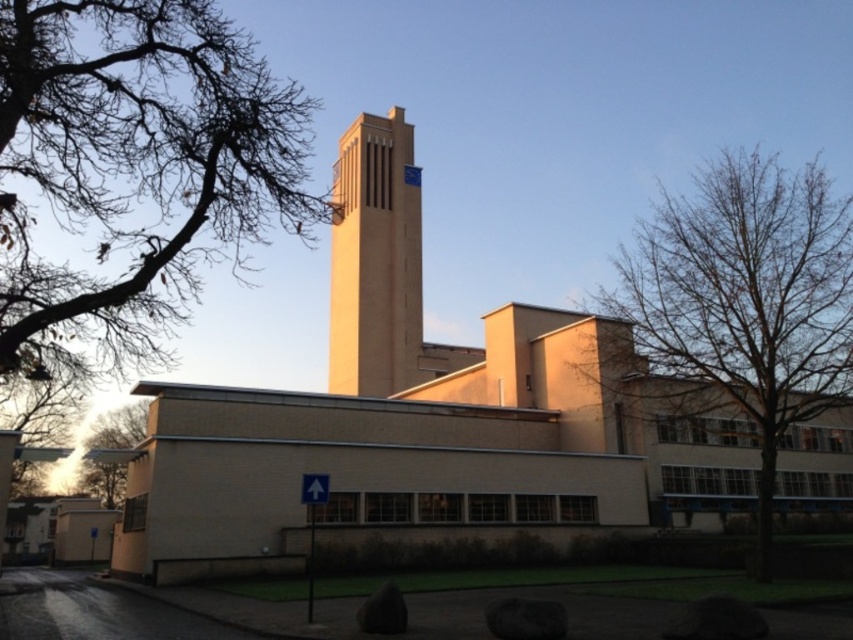
You are standing in front of the modernist building and want to take a photo of the beige brick tower at center and the green leafy tree at lower left. Which object will appear larger in the photo?

The beige brick tower at center will appear larger in the photo because it is above the green leafy tree at lower left, meaning it is closer to the camera and thus appears bigger.